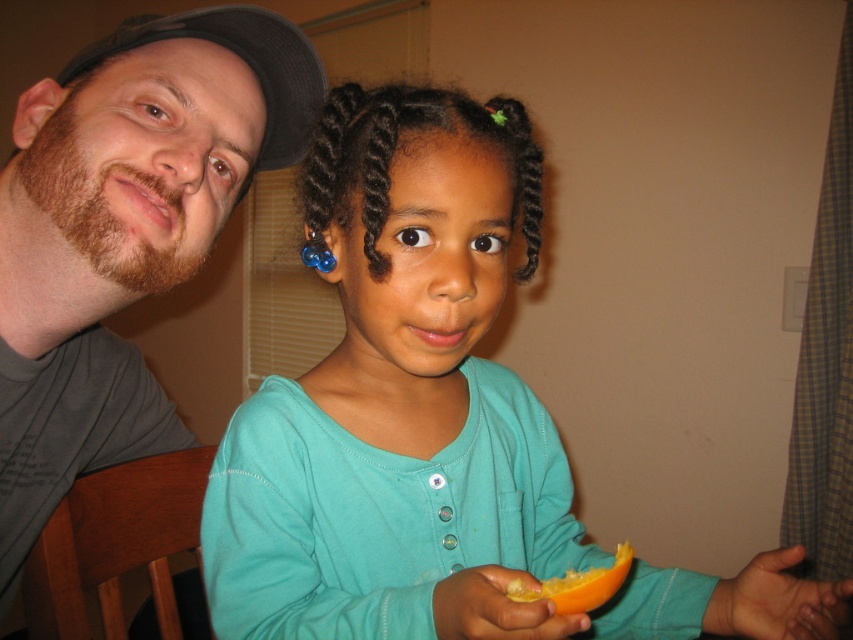
Image resolution: width=853 pixels, height=640 pixels. What do you see at coordinates (125, 230) in the screenshot?
I see `matte gray t-shirt at left` at bounding box center [125, 230].

Is matte gray t-shirt at left wider than orange flesh at lower center?

Correct, the width of matte gray t-shirt at left exceeds that of orange flesh at lower center.

You are a GUI agent. You are given a task and a screenshot of the screen. Output one action in this format:
    pyautogui.click(x=<x>, y=<y>)
    Task: Click on the matte gray t-shirt at left
    The image size is (853, 640).
    Given the screenshot: What is the action you would take?
    pyautogui.click(x=125, y=230)

Locate an element on the screen. Image resolution: width=853 pixels, height=640 pixels. matte gray t-shirt at left is located at coordinates (125, 230).

Can you confirm if matte gray t-shirt at left is wider than black fabric baseball cap at upper left?

Yes.

Where is `matte gray t-shirt at left`? This screenshot has height=640, width=853. matte gray t-shirt at left is located at coordinates (125, 230).

Describe the element at coordinates (125, 230) in the screenshot. The image size is (853, 640). I see `matte gray t-shirt at left` at that location.

Find the location of a particular element. The width and height of the screenshot is (853, 640). matte gray t-shirt at left is located at coordinates (125, 230).

Does black fabric baseball cap at upper left have a greater width compared to orange flesh at lower center?

Yes, black fabric baseball cap at upper left is wider than orange flesh at lower center.

Does black fabric baseball cap at upper left come in front of orange flesh at lower center?

No, black fabric baseball cap at upper left is further to the viewer.

Find the location of a particular element. The width and height of the screenshot is (853, 640). black fabric baseball cap at upper left is located at coordinates (242, 60).

Where is `black fabric baseball cap at upper left`? This screenshot has width=853, height=640. black fabric baseball cap at upper left is located at coordinates (242, 60).